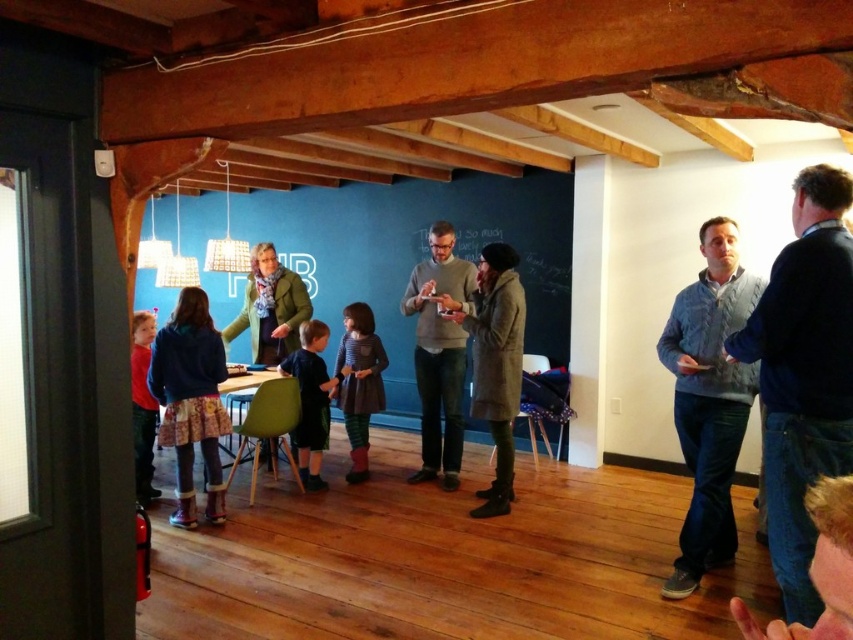
Question: Can you confirm if light blue sweater at right is wider than dark blue shirt at center?

Choices:
 (A) yes
 (B) no

Answer: (A)

Question: Which of the following is the closest to the observer?

Choices:
 (A) (187, 358)
 (B) (688, 516)

Answer: (B)

Question: Which object appears closest to the camera in this image?

Choices:
 (A) red matte sweater at left
 (B) matte gray dress at center
 (C) gray sweater at center

Answer: (A)

Question: Which object is closer to the camera taking this photo?

Choices:
 (A) dark blue shirt at center
 (B) fluffy pink boots at lower left
 (C) dark blue sweater at right
 (D) matte black chalkboard at center

Answer: (C)

Question: Can you confirm if gray sweater at center is positioned to the left of dark gray wool coat at center?

Choices:
 (A) yes
 (B) no

Answer: (A)

Question: Is the position of fluffy pink boots at lower left more distant than that of matte gray dress at center?

Choices:
 (A) yes
 (B) no

Answer: (B)